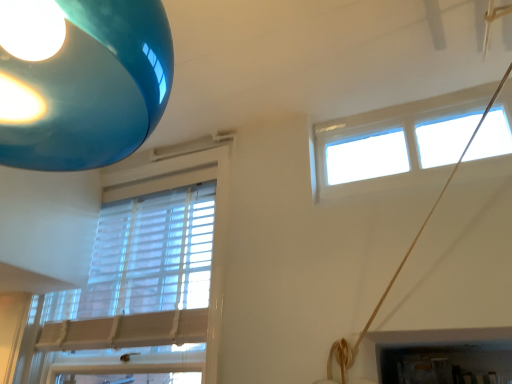
How much space does white plastic window at upper right, the first window in the right-to-left sequence, occupy horizontally?

white plastic window at upper right, the first window in the right-to-left sequence, is 7.36 inches wide.

What are the coordinates of `white plastic window at upper right, the first window in the right-to-left sequence` in the screenshot? It's located at (403, 141).

The height and width of the screenshot is (384, 512). What do you see at coordinates (403, 141) in the screenshot?
I see `white plastic window at upper right, marked as the second window in a left-to-right arrangement` at bounding box center [403, 141].

This screenshot has width=512, height=384. What do you see at coordinates (215, 218) in the screenshot?
I see `white textured blinds at left, the 1th window from the left` at bounding box center [215, 218].

Find the location of a particular element. white textured blinds at left, arranged as the second window when viewed from the right is located at coordinates (215, 218).

What is the approximate width of white textured blinds at left, arranged as the second window when viewed from the right?

7.64 inches.

In order to click on white plastic window at upper right, the first window in the right-to-left sequence in this screenshot , I will do `click(403, 141)`.

Considering the positions of objects white plastic window at upper right, marked as the second window in a left-to-right arrangement, and white textured blinds at left, the 1th window from the left, in the image provided, who is more to the left, white plastic window at upper right, marked as the second window in a left-to-right arrangement, or white textured blinds at left, the 1th window from the left,?

white textured blinds at left, the 1th window from the left.

Is white plastic window at upper right, marked as the second window in a left-to-right arrangement, further to camera compared to white textured blinds at left, arranged as the second window when viewed from the right?

That is False.

Is point (388, 152) positioned behind point (49, 377)?

No, it is in front of (49, 377).

From the image's perspective, between white plastic window at upper right, marked as the second window in a left-to-right arrangement, and white textured blinds at left, arranged as the second window when viewed from the right, who is located below?

white textured blinds at left, arranged as the second window when viewed from the right, is shown below in the image.

From a real-world perspective, which object rests below the other?

white textured blinds at left, the 1th window from the left, from a real-world perspective.

Consider the image. Can you confirm if white plastic window at upper right, marked as the second window in a left-to-right arrangement, is wider than white textured blinds at left, the 1th window from the left?

Incorrect, the width of white plastic window at upper right, marked as the second window in a left-to-right arrangement, does not surpass that of white textured blinds at left, the 1th window from the left.

From their relative heights in the image, would you say white plastic window at upper right, the first window in the right-to-left sequence, is taller or shorter than white textured blinds at left, the 1th window from the left?

In the image, white plastic window at upper right, the first window in the right-to-left sequence, appears to be shorter than white textured blinds at left, the 1th window from the left.

Considering the relative sizes of white plastic window at upper right, marked as the second window in a left-to-right arrangement, and white textured blinds at left, arranged as the second window when viewed from the right, in the image provided, is white plastic window at upper right, marked as the second window in a left-to-right arrangement, smaller than white textured blinds at left, arranged as the second window when viewed from the right,?

Yes.

Would you say white plastic window at upper right, marked as the second window in a left-to-right arrangement, is inside or outside white textured blinds at left, the 1th window from the left?

white plastic window at upper right, marked as the second window in a left-to-right arrangement, lies outside white textured blinds at left, the 1th window from the left.

Is white plastic window at upper right, marked as the second window in a left-to-right arrangement, positioned with its back to white textured blinds at left, the 1th window from the left?

No.

The height and width of the screenshot is (384, 512). Identify the location of window that appears on the right of white textured blinds at left, the 1th window from the left. (403, 141).

Is white textured blinds at left, arranged as the second window when viewed from the right, at the right side of white plastic window at upper right, the first window in the right-to-left sequence?

No, white textured blinds at left, arranged as the second window when viewed from the right, is not to the right of white plastic window at upper right, the first window in the right-to-left sequence.

Which object is closer to the camera taking this photo, white textured blinds at left, the 1th window from the left, or white plastic window at upper right, marked as the second window in a left-to-right arrangement?

white plastic window at upper right, marked as the second window in a left-to-right arrangement, is in front.

Which is nearer, (207, 150) or (329, 196)?

Point (329, 196)

From the image's perspective, which one is positioned lower, white textured blinds at left, the 1th window from the left, or white plastic window at upper right, marked as the second window in a left-to-right arrangement?

white textured blinds at left, the 1th window from the left, appears lower in the image.

From a real-world perspective, is white textured blinds at left, the 1th window from the left, on white plastic window at upper right, marked as the second window in a left-to-right arrangement?

Actually, white textured blinds at left, the 1th window from the left, is physically below white plastic window at upper right, marked as the second window in a left-to-right arrangement, in the real world.

Considering the relative sizes of white textured blinds at left, the 1th window from the left, and white plastic window at upper right, marked as the second window in a left-to-right arrangement, in the image provided, is white textured blinds at left, the 1th window from the left, thinner than white plastic window at upper right, marked as the second window in a left-to-right arrangement,?

In fact, white textured blinds at left, the 1th window from the left, might be wider than white plastic window at upper right, marked as the second window in a left-to-right arrangement.

Considering the sizes of white textured blinds at left, arranged as the second window when viewed from the right, and white plastic window at upper right, marked as the second window in a left-to-right arrangement, in the image, is white textured blinds at left, arranged as the second window when viewed from the right, taller or shorter than white plastic window at upper right, marked as the second window in a left-to-right arrangement,?

In the image, white textured blinds at left, arranged as the second window when viewed from the right, appears to be taller than white plastic window at upper right, marked as the second window in a left-to-right arrangement.

Who is bigger, white textured blinds at left, the 1th window from the left, or white plastic window at upper right, the first window in the right-to-left sequence?

Bigger between the two is white textured blinds at left, the 1th window from the left.

Is white plastic window at upper right, marked as the second window in a left-to-right arrangement, located within white textured blinds at left, the 1th window from the left?

No, white textured blinds at left, the 1th window from the left, does not contain white plastic window at upper right, marked as the second window in a left-to-right arrangement.

Are white textured blinds at left, arranged as the second window when viewed from the right, and white plastic window at upper right, marked as the second window in a left-to-right arrangement, far apart?

No.

Could you tell me if white textured blinds at left, arranged as the second window when viewed from the right, is turned towards white plastic window at upper right, the first window in the right-to-left sequence?

No, white textured blinds at left, arranged as the second window when viewed from the right, is not facing towards white plastic window at upper right, the first window in the right-to-left sequence.

Looking at this image, what's the angular difference between white textured blinds at left, arranged as the second window when viewed from the right, and white plastic window at upper right, marked as the second window in a left-to-right arrangement,'s facing directions?

The angle between the facing direction of white textured blinds at left, arranged as the second window when viewed from the right, and the facing direction of white plastic window at upper right, marked as the second window in a left-to-right arrangement, is 2.35 degrees.

Identify the location of window positioned vertically above the white textured blinds at left, the 1th window from the left (from a real-world perspective). (403, 141).

This screenshot has width=512, height=384. I want to click on window on the right of white textured blinds at left, the 1th window from the left, so click(403, 141).

Where is `window above the white textured blinds at left, arranged as the second window when viewed from the right (from the image's perspective)`? This screenshot has height=384, width=512. window above the white textured blinds at left, arranged as the second window when viewed from the right (from the image's perspective) is located at coordinates (403, 141).